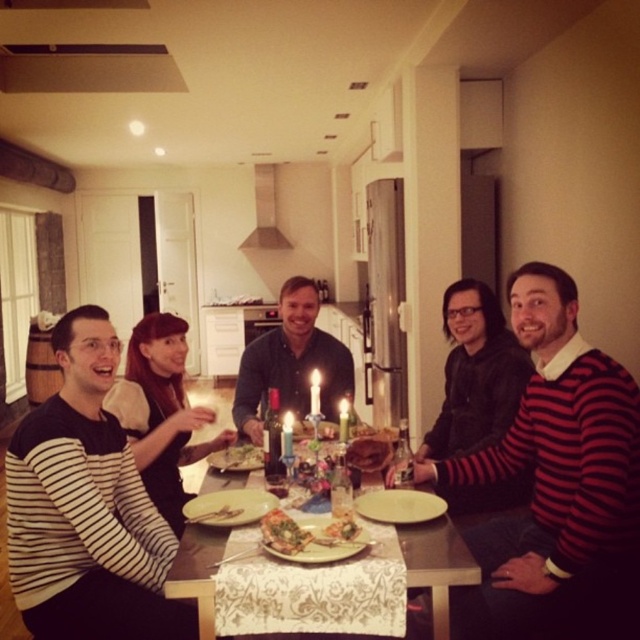
Who is more forward, (131, 564) or (234, 456)?

Positioned in front is point (131, 564).

How far apart are striped sweater at left and green leafy salad at center?

striped sweater at left and green leafy salad at center are 20.82 inches apart from each other.

At what (x,y) coordinates should I click in order to perform the action: click on striped sweater at left. Please return your answer as a coordinate pair (x, y). Looking at the image, I should click on pos(86,508).

The height and width of the screenshot is (640, 640). Find the location of `striped sweater at left`. striped sweater at left is located at coordinates (86, 508).

Is matte dark blue shirt at center bigger than golden crispy pizza at center?

Indeed, matte dark blue shirt at center has a larger size compared to golden crispy pizza at center.

Between point (310, 336) and point (355, 531), which one is positioned behind?

Positioned behind is point (310, 336).

Does point (324, 348) come farther from viewer compared to point (339, 536)?

Yes, it is behind point (339, 536).

Where is `matte dark blue shirt at center`? This screenshot has height=640, width=640. matte dark blue shirt at center is located at coordinates (291, 362).

Can you confirm if green wax candle at center is thinner than white wax candle at center?

No, green wax candle at center is not thinner than white wax candle at center.

Is point (291, 442) closer to camera compared to point (317, 413)?

Yes, point (291, 442) is closer to viewer.

Where is `green wax candle at center`? The height and width of the screenshot is (640, 640). green wax candle at center is located at coordinates (285, 435).